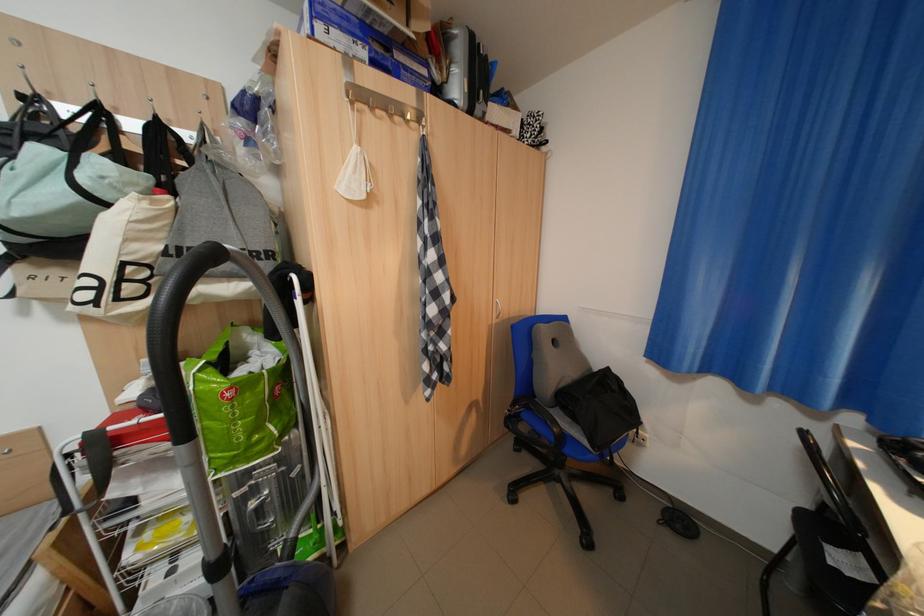
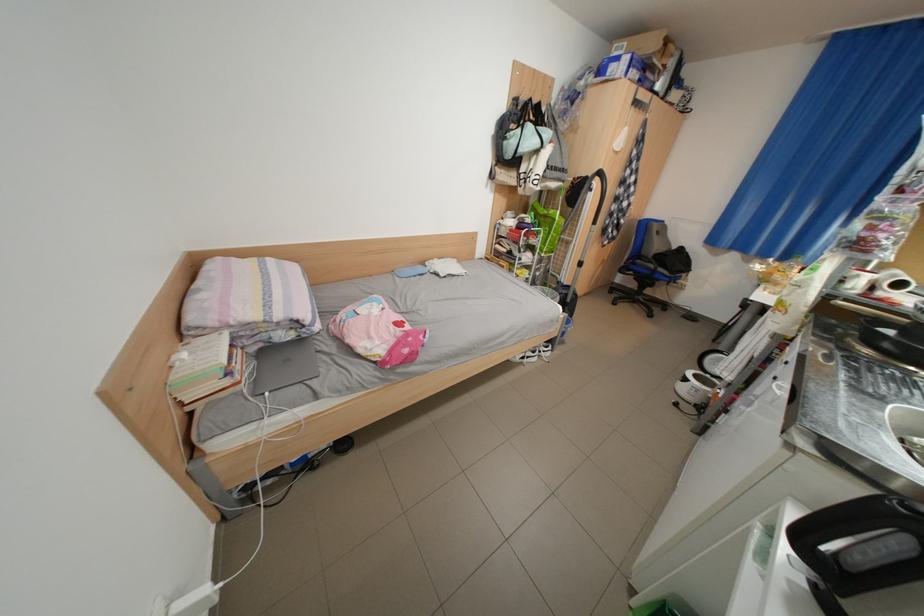
In the second image, find the point that corresponds to point (616, 402) in the first image.

(687, 264)